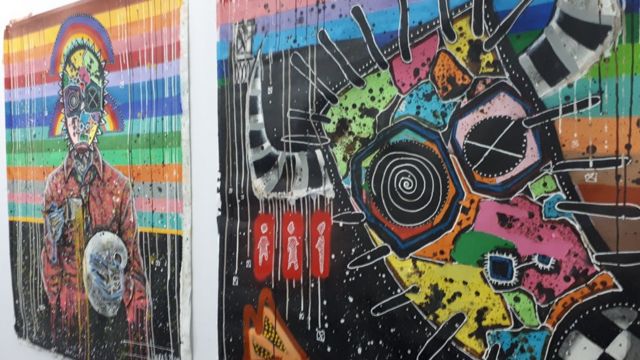
Locate an element on the screen. empty space between art pieces is located at coordinates (204, 16), (208, 140), (202, 327).